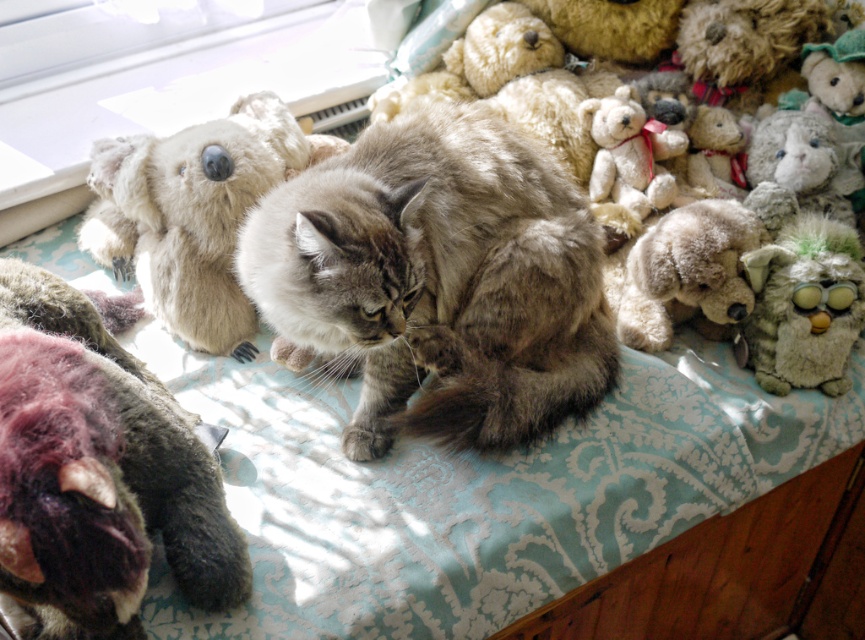
You are a child looking at the green fuzzy owl at right and the white fluffy teddy bear at upper center on the table. Which stuffed animal is closer to you?

The white fluffy teddy bear at upper center is closer to you because it is positioned above the green fuzzy owl at right, meaning the owl is behind it.